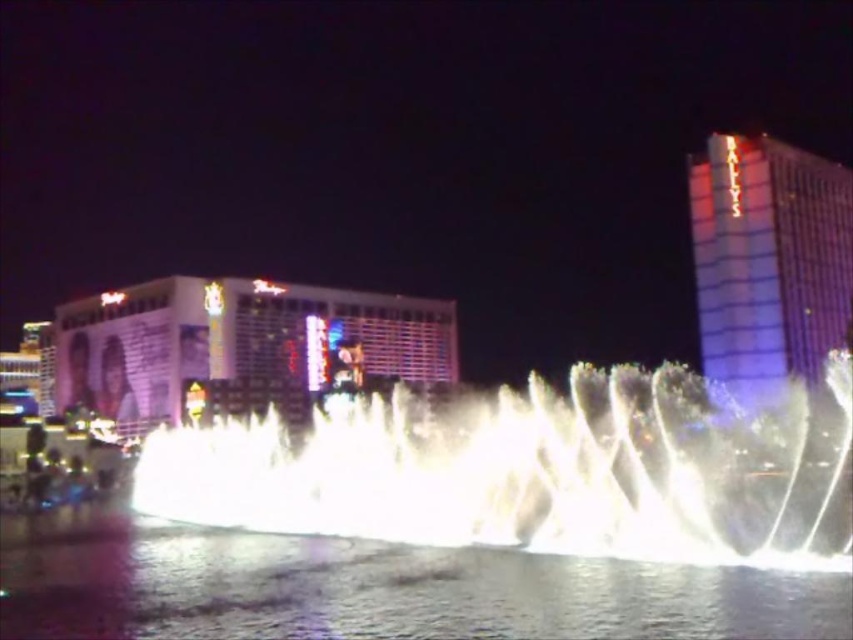
Who is lower down, white frothy water at center or matte glass hotel at center?

white frothy water at center is below.

Can you confirm if white frothy water at center is positioned below matte glass hotel at center?

Yes.

Locate an element on the screen. Image resolution: width=853 pixels, height=640 pixels. white frothy water at center is located at coordinates click(535, 472).

Does clear liquid water at center appear over metallic glass building at upper right?

No.

Describe the element at coordinates (375, 588) in the screenshot. This screenshot has height=640, width=853. I see `clear liquid water at center` at that location.

Where is `clear liquid water at center`? clear liquid water at center is located at coordinates (375, 588).

Where is `clear liquid water at center`? clear liquid water at center is located at coordinates (375, 588).

Does point (367, 634) come in front of point (99, 356)?

That is True.

Find the location of a particular element. The image size is (853, 640). clear liquid water at center is located at coordinates (375, 588).